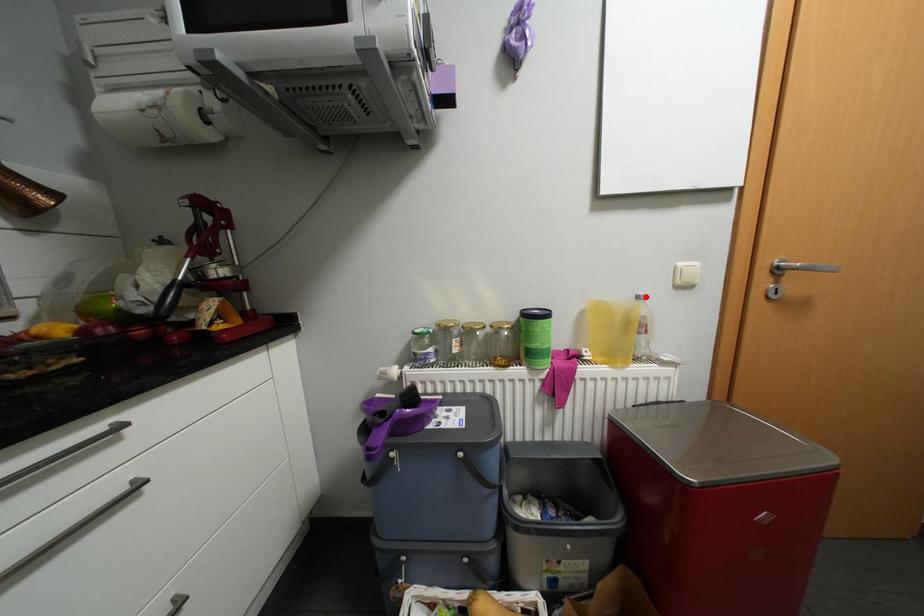
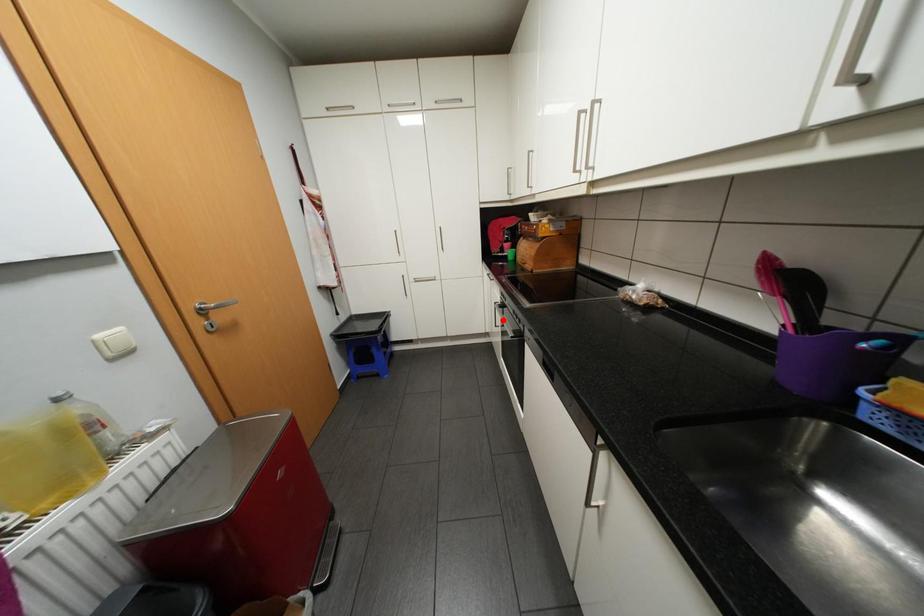
I am providing you with two images of the same scene from different viewpoints. A red point is marked on the first image and another point is marked on the second image. Does the point marked in image1 correspond to the same location as the one in image2?

No